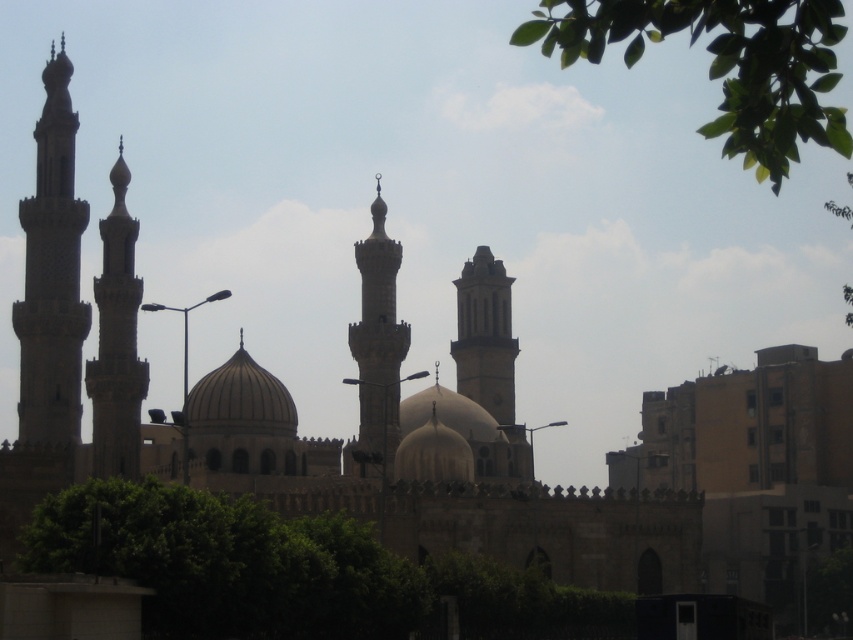
Question: Estimate the real-world distances between objects in this image. Which object is farther from the smooth stone minaret at center?

Choices:
 (A) smooth beige dome at center
 (B) stone minaret at left

Answer: (B)

Question: Is stone minaret at left thinner than smooth beige minaret at center?

Choices:
 (A) yes
 (B) no

Answer: (A)

Question: Is gray stone minaret at left positioned before smooth stone minaret at center?

Choices:
 (A) no
 (B) yes

Answer: (B)

Question: Can you confirm if smooth stone minaret at center is positioned to the left of smooth beige dome at center?

Choices:
 (A) no
 (B) yes

Answer: (A)

Question: Considering the real-world distances, which object is closest to the smooth beige minaret at center?

Choices:
 (A) smooth beige dome at center
 (B) stone minaret at left
 (C) smooth stone minaret at center
 (D) gray stone minaret at left

Answer: (A)

Question: Based on their relative distances, which object is farther from the smooth stone minaret at center?

Choices:
 (A) gray stone minaret at left
 (B) smooth beige dome at center

Answer: (A)